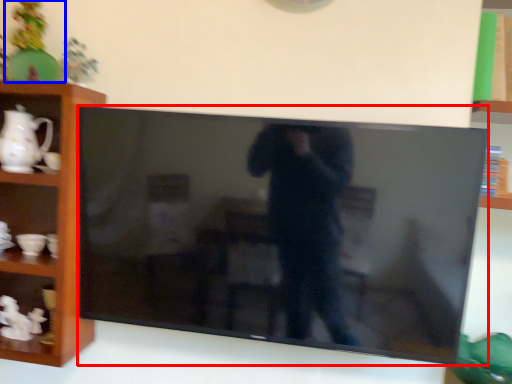
Question: Among these objects, which one is farthest to the camera, television (highlighted by a red box) or toy (highlighted by a blue box)?

Choices:
 (A) television
 (B) toy

Answer: (B)